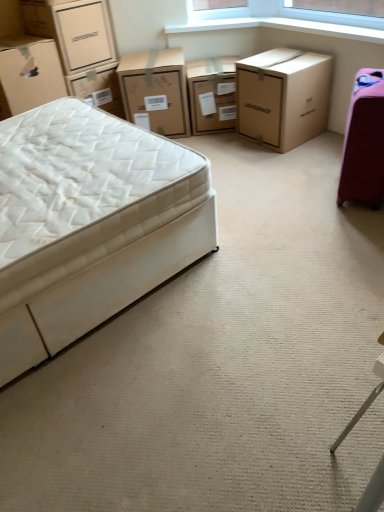
You are a GUI agent. You are given a task and a screenshot of the screen. Output one action in this format:
    pyautogui.click(x=<x>, y=<y>)
    Task: Click on the matte cardboard box at upper left, placed as the 2th box when sorted from bottom to top
    The width and height of the screenshot is (384, 512).
    Given the screenshot: What is the action you would take?
    pyautogui.click(x=83, y=34)

This screenshot has height=512, width=384. Find the location of `matte cardboard chest of drawers at center, which is the 2th chest of drawers in right-to-left order`. matte cardboard chest of drawers at center, which is the 2th chest of drawers in right-to-left order is located at coordinates (212, 94).

Measure the distance between matte cardboard chest of drawers at upper center, positioned as the third chest of drawers in right-to-left order, and camera.

matte cardboard chest of drawers at upper center, positioned as the third chest of drawers in right-to-left order, is 9.82 feet away from camera.

What do you see at coordinates (156, 90) in the screenshot?
I see `matte cardboard chest of drawers at upper center, positioned as the third chest of drawers in right-to-left order` at bounding box center [156, 90].

Describe the element at coordinates (85, 223) in the screenshot. I see `white fabric bed at left` at that location.

At what (x,y) coordinates should I click in order to perform the action: click on matte cardboard box at upper left, arranged as the 1th box when viewed from the top. Please return your answer as a coordinate pair (x, y). This screenshot has height=512, width=384. Looking at the image, I should click on [x=83, y=34].

Could you tell me if matte cardboard chest of drawers at center, which is the 2th chest of drawers in right-to-left order, is facing matte cardboard box at upper left, positioned as the second box in top-to-bottom order?

No, matte cardboard chest of drawers at center, which is the 2th chest of drawers in right-to-left order, is not oriented towards matte cardboard box at upper left, positioned as the second box in top-to-bottom order.

Considering the sizes of objects matte cardboard chest of drawers at center, which is the 2th chest of drawers in left-to-right order, and matte cardboard box at upper left, positioned as the second box in top-to-bottom order, in the image provided, who is wider, matte cardboard chest of drawers at center, which is the 2th chest of drawers in left-to-right order, or matte cardboard box at upper left, positioned as the second box in top-to-bottom order,?

matte cardboard box at upper left, positioned as the second box in top-to-bottom order.

Considering the points (214, 96) and (19, 61), which point is in front, point (214, 96) or point (19, 61)?

The point (19, 61) is closer to the camera.

Does matte cardboard chest of drawers at center, which is the 2th chest of drawers in right-to-left order, come behind matte cardboard box at upper left, which appears as the 1th box when ordered from the bottom?

Yes, matte cardboard chest of drawers at center, which is the 2th chest of drawers in right-to-left order, is further from the camera.

Who is shorter, matte cardboard box at upper left, placed as the 2th box when sorted from bottom to top, or matte cardboard chest of drawers at upper center, positioned as the third chest of drawers in right-to-left order?

matte cardboard box at upper left, placed as the 2th box when sorted from bottom to top, is shorter.

Is matte cardboard box at upper left, arranged as the 1th box when viewed from the top, inside or outside of matte cardboard chest of drawers at upper center, acting as the 1th chest of drawers starting from the left?

matte cardboard box at upper left, arranged as the 1th box when viewed from the top, is outside matte cardboard chest of drawers at upper center, acting as the 1th chest of drawers starting from the left.

Is point (78, 6) more distant than point (188, 115)?

No, it is in front of (188, 115).

Who is bigger, matte cardboard box at upper left, arranged as the 1th box when viewed from the top, or matte cardboard chest of drawers at upper center, positioned as the third chest of drawers in right-to-left order?

matte cardboard chest of drawers at upper center, positioned as the third chest of drawers in right-to-left order, is bigger.

Is matte cardboard chest of drawers at upper center, positioned as the third chest of drawers in right-to-left order, not inside matte cardboard chest of drawers at center, which is the 2th chest of drawers in left-to-right order?

Yes.

Which of these two, matte cardboard chest of drawers at upper center, acting as the 1th chest of drawers starting from the left, or matte cardboard chest of drawers at center, which is the 2th chest of drawers in left-to-right order, stands taller?

Standing taller between the two is matte cardboard chest of drawers at upper center, acting as the 1th chest of drawers starting from the left.

Considering the positions of objects matte cardboard chest of drawers at upper center, positioned as the third chest of drawers in right-to-left order, and matte cardboard chest of drawers at center, which is the 2th chest of drawers in left-to-right order, in the image provided, who is more to the right, matte cardboard chest of drawers at upper center, positioned as the third chest of drawers in right-to-left order, or matte cardboard chest of drawers at center, which is the 2th chest of drawers in left-to-right order,?

matte cardboard chest of drawers at center, which is the 2th chest of drawers in left-to-right order, is more to the right.

This screenshot has height=512, width=384. In order to click on chest of drawers on the left of matte cardboard chest of drawers at center, which is the 2th chest of drawers in right-to-left order in this screenshot , I will do `click(156, 90)`.

From a real-world perspective, is matte cardboard box at upper left, positioned as the second box in top-to-bottom order, located beneath matte cardboard box at upper left, arranged as the 1th box when viewed from the top?

Yes, from a real-world perspective, matte cardboard box at upper left, positioned as the second box in top-to-bottom order, is under matte cardboard box at upper left, arranged as the 1th box when viewed from the top.

Are matte cardboard box at upper left, which appears as the 1th box when ordered from the bottom, and matte cardboard box at upper left, placed as the 2th box when sorted from bottom to top, making contact?

matte cardboard box at upper left, which appears as the 1th box when ordered from the bottom, and matte cardboard box at upper left, placed as the 2th box when sorted from bottom to top, are clearly separated.

Does matte cardboard box at upper left, which appears as the 1th box when ordered from the bottom, have a greater height compared to matte cardboard box at upper left, arranged as the 1th box when viewed from the top?

Correct, matte cardboard box at upper left, which appears as the 1th box when ordered from the bottom, is much taller as matte cardboard box at upper left, arranged as the 1th box when viewed from the top.

Does matte cardboard box at upper left, which appears as the 1th box when ordered from the bottom, turn towards matte cardboard box at upper left, arranged as the 1th box when viewed from the top?

No, matte cardboard box at upper left, which appears as the 1th box when ordered from the bottom, does not turn towards matte cardboard box at upper left, arranged as the 1th box when viewed from the top.

From the image's perspective, does brown cardboard box at upper right, which is the 3th chest of drawers in left-to-right order, appear higher than matte cardboard box at upper left, placed as the 2th box when sorted from bottom to top?

No.

From the picture: Considering the positions of objects brown cardboard box at upper right, the first chest of drawers when ordered from right to left, and matte cardboard box at upper left, placed as the 2th box when sorted from bottom to top, in the image provided, who is behind, brown cardboard box at upper right, the first chest of drawers when ordered from right to left, or matte cardboard box at upper left, placed as the 2th box when sorted from bottom to top,?

matte cardboard box at upper left, placed as the 2th box when sorted from bottom to top, is further from the camera.

From the picture: From a real-world perspective, is brown cardboard box at upper right, which is the 3th chest of drawers in left-to-right order, physically above matte cardboard box at upper left, arranged as the 1th box when viewed from the top?

Actually, brown cardboard box at upper right, which is the 3th chest of drawers in left-to-right order, is physically below matte cardboard box at upper left, arranged as the 1th box when viewed from the top, in the real world.

Are brown cardboard box at upper right, which is the 3th chest of drawers in left-to-right order, and matte cardboard box at upper left, placed as the 2th box when sorted from bottom to top, located far from each other?

brown cardboard box at upper right, which is the 3th chest of drawers in left-to-right order, is far away from matte cardboard box at upper left, placed as the 2th box when sorted from bottom to top.

In terms of width, does matte cardboard chest of drawers at center, which is the 2th chest of drawers in left-to-right order, look wider or thinner when compared to matte cardboard chest of drawers at upper center, positioned as the third chest of drawers in right-to-left order?

matte cardboard chest of drawers at center, which is the 2th chest of drawers in left-to-right order, is thinner than matte cardboard chest of drawers at upper center, positioned as the third chest of drawers in right-to-left order.

Do you think matte cardboard chest of drawers at center, which is the 2th chest of drawers in left-to-right order, is within matte cardboard chest of drawers at upper center, positioned as the third chest of drawers in right-to-left order, or outside of it?

matte cardboard chest of drawers at center, which is the 2th chest of drawers in left-to-right order, lies outside matte cardboard chest of drawers at upper center, positioned as the third chest of drawers in right-to-left order.

Between point (226, 69) and point (159, 118), which one is positioned in front?

The point (226, 69) is closer to the camera.

Between matte cardboard chest of drawers at center, which is the 2th chest of drawers in left-to-right order, and matte cardboard chest of drawers at upper center, positioned as the third chest of drawers in right-to-left order, which one appears on the left side from the viewer's perspective?

matte cardboard chest of drawers at upper center, positioned as the third chest of drawers in right-to-left order, is more to the left.

Image resolution: width=384 pixels, height=512 pixels. I want to click on bed that is below the matte cardboard box at upper left, arranged as the 1th box when viewed from the top (from the image's perspective), so click(85, 223).

Is white fabric bed at left oriented towards matte cardboard box at upper left, arranged as the 1th box when viewed from the top?

No, white fabric bed at left does not turn towards matte cardboard box at upper left, arranged as the 1th box when viewed from the top.

Is the position of white fabric bed at left more distant than that of matte cardboard box at upper left, arranged as the 1th box when viewed from the top?

No, the depth of white fabric bed at left is less than that of matte cardboard box at upper left, arranged as the 1th box when viewed from the top.

From the image's perspective, is white fabric bed at left located above or below matte cardboard box at upper left, placed as the 2th box when sorted from bottom to top?

white fabric bed at left is below matte cardboard box at upper left, placed as the 2th box when sorted from bottom to top.

Locate an element on the screen. This screenshot has width=384, height=512. the 3rd chest of drawers behind the matte cardboard box at upper left, which appears as the 1th box when ordered from the bottom, counting from the anchor's position is located at coordinates (212, 94).

Find the location of a particular element. This screenshot has height=512, width=384. the chest of drawers that is the 1st object directly below the matte cardboard box at upper left, placed as the 2th box when sorted from bottom to top (from a real-world perspective) is located at coordinates (156, 90).

Considering their positions, is matte cardboard chest of drawers at upper center, positioned as the third chest of drawers in right-to-left order, positioned closer to matte cardboard box at upper left, positioned as the second box in top-to-bottom order, than matte cardboard chest of drawers at center, which is the 2th chest of drawers in left-to-right order?

Based on the image, matte cardboard chest of drawers at upper center, positioned as the third chest of drawers in right-to-left order, appears to be nearer to matte cardboard box at upper left, positioned as the second box in top-to-bottom order.

From the image, which object appears to be nearer to matte cardboard box at upper left, which appears as the 1th box when ordered from the bottom, matte cardboard chest of drawers at center, which is the 2th chest of drawers in right-to-left order, or white fabric bed at left?

The object closer to matte cardboard box at upper left, which appears as the 1th box when ordered from the bottom, is white fabric bed at left.

Estimate the real-world distances between objects in this image. Which object is closer to matte cardboard chest of drawers at upper center, acting as the 1th chest of drawers starting from the left, matte cardboard box at upper left, arranged as the 1th box when viewed from the top, or white fabric bed at left?

matte cardboard box at upper left, arranged as the 1th box when viewed from the top.

Looking at the image, which one is located further to white fabric bed at left, matte cardboard box at upper left, which appears as the 1th box when ordered from the bottom, or matte cardboard chest of drawers at center, which is the 2th chest of drawers in left-to-right order?

matte cardboard chest of drawers at center, which is the 2th chest of drawers in left-to-right order, lies further to white fabric bed at left than the other object.

Estimate the real-world distances between objects in this image. Which object is closer to matte cardboard box at upper left, which appears as the 1th box when ordered from the bottom, matte cardboard chest of drawers at upper center, acting as the 1th chest of drawers starting from the left, or matte cardboard box at upper left, arranged as the 1th box when viewed from the top?

The object closer to matte cardboard box at upper left, which appears as the 1th box when ordered from the bottom, is matte cardboard box at upper left, arranged as the 1th box when viewed from the top.

Looking at the image, which one is located further to white fabric bed at left, brown cardboard box at upper right, which is the 3th chest of drawers in left-to-right order, or matte cardboard chest of drawers at center, which is the 2th chest of drawers in right-to-left order?

Among the two, matte cardboard chest of drawers at center, which is the 2th chest of drawers in right-to-left order, is located further to white fabric bed at left.

From the image, which object appears to be farther from matte cardboard chest of drawers at center, which is the 2th chest of drawers in right-to-left order, brown cardboard box at upper right, which is the 3th chest of drawers in left-to-right order, or white fabric bed at left?

The object further to matte cardboard chest of drawers at center, which is the 2th chest of drawers in right-to-left order, is white fabric bed at left.

When comparing their distances from brown cardboard box at upper right, the first chest of drawers when ordered from right to left, does matte cardboard chest of drawers at center, which is the 2th chest of drawers in left-to-right order, or matte cardboard box at upper left, positioned as the second box in top-to-bottom order, seem further?

matte cardboard box at upper left, positioned as the second box in top-to-bottom order, is positioned further to the anchor brown cardboard box at upper right, the first chest of drawers when ordered from right to left.

I want to click on the chest of drawers located between matte cardboard box at upper left, positioned as the second box in top-to-bottom order, and matte cardboard chest of drawers at center, which is the 2th chest of drawers in left-to-right order, in the left-right direction, so click(x=156, y=90).

The image size is (384, 512). Identify the location of box between matte cardboard box at upper left, which appears as the 1th box when ordered from the bottom, and matte cardboard chest of drawers at upper center, acting as the 1th chest of drawers starting from the left, in the horizontal direction. [x=83, y=34].

In order to click on box positioned between white fabric bed at left and matte cardboard box at upper left, placed as the 2th box when sorted from bottom to top, from near to far in this screenshot , I will do `click(28, 74)`.

Find the location of a particular element. The width and height of the screenshot is (384, 512). box situated between matte cardboard box at upper left, positioned as the second box in top-to-bottom order, and brown cardboard box at upper right, the first chest of drawers when ordered from right to left, from left to right is located at coordinates (83, 34).